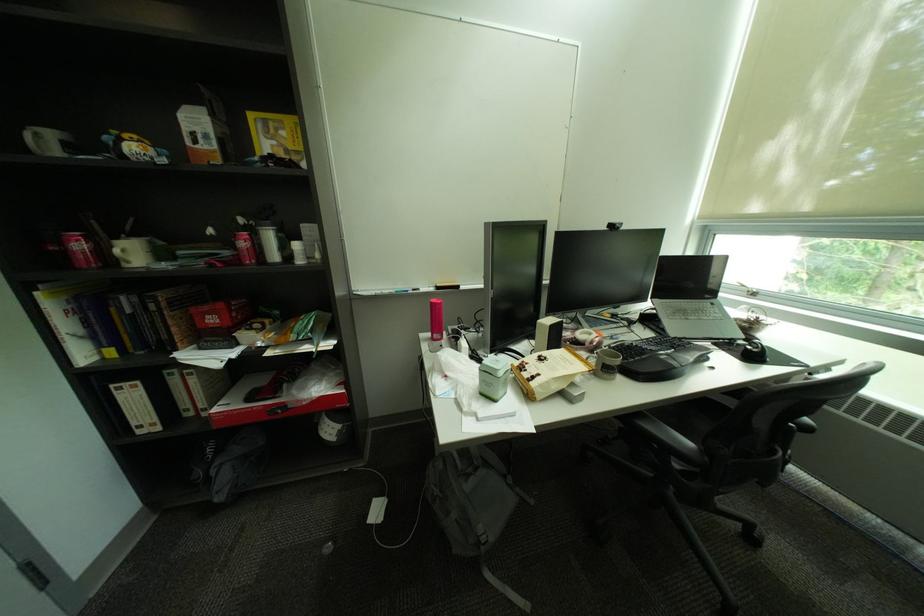
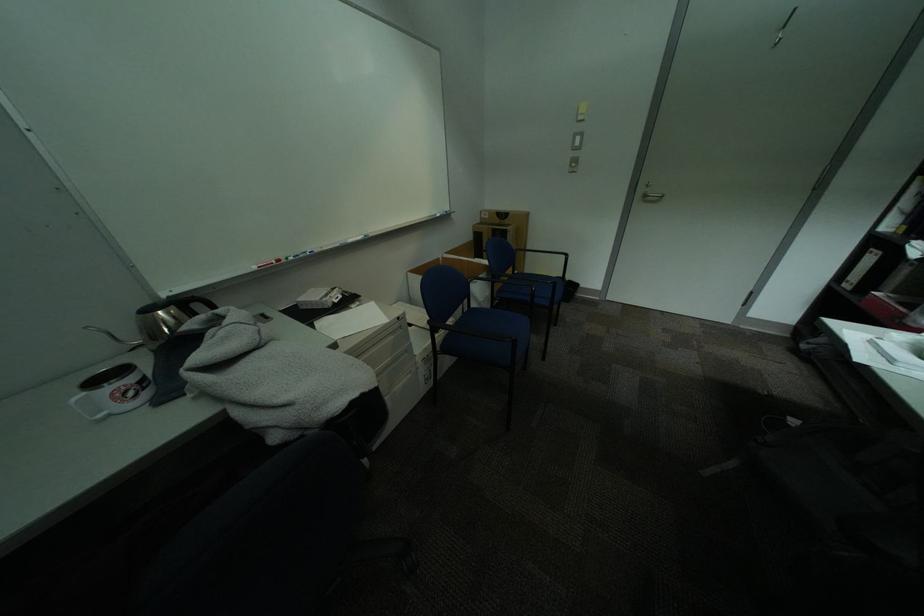
The point at (x=146, y=424) is marked in the first image. Where is the corresponding point in the second image?

(859, 280)